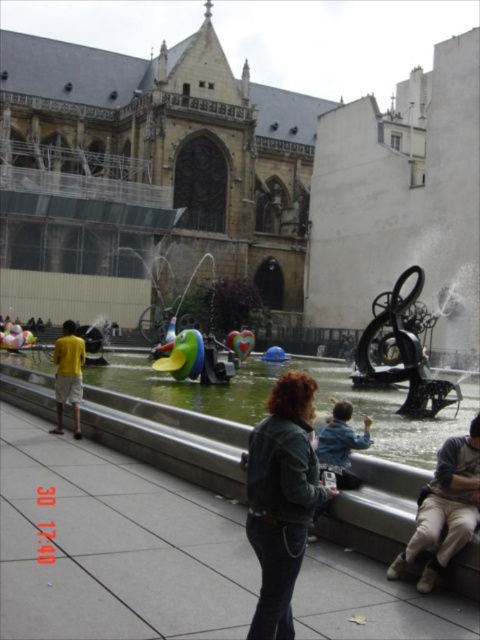
Does denim jacket at lower right have a lesser height compared to khaki cotton pants at lower right?

No, denim jacket at lower right is not shorter than khaki cotton pants at lower right.

Between denim jacket at lower right and khaki cotton pants at lower right, which one has more height?

Standing taller between the two is denim jacket at lower right.

Does point (297, 563) lie in front of point (464, 438)?

That is True.

Identify the location of denim jacket at lower right. Image resolution: width=480 pixels, height=640 pixels. (280, 499).

Consider the image. Between green rubber duck at center and khaki cotton pants at lower right, which one has more height?

Standing taller between the two is khaki cotton pants at lower right.

Find the location of a particular element. Image resolution: width=480 pixels, height=640 pixels. green rubber duck at center is located at coordinates (315, 397).

Where is `green rubber duck at center`? The image size is (480, 640). green rubber duck at center is located at coordinates (315, 397).

Does green rubber duck at center appear on the left side of denim jacket at lower right?

Indeed, green rubber duck at center is positioned on the left side of denim jacket at lower right.

Is point (405, 436) behind point (313, 502)?

Yes, it is.

Which is behind, point (394, 420) or point (263, 609)?

The point (394, 420) is behind.

Find the location of a particular element. The width and height of the screenshot is (480, 640). green rubber duck at center is located at coordinates (315, 397).